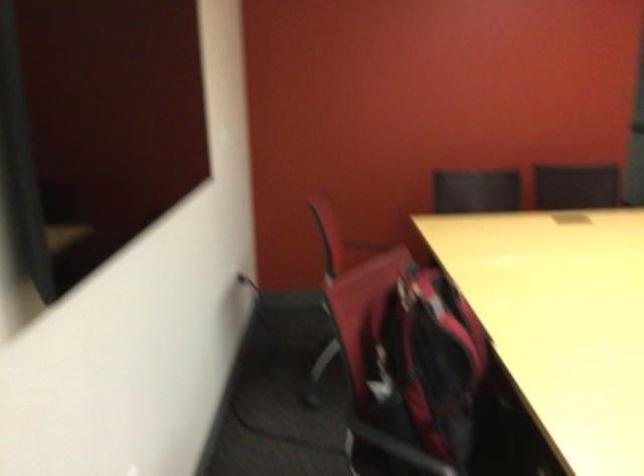
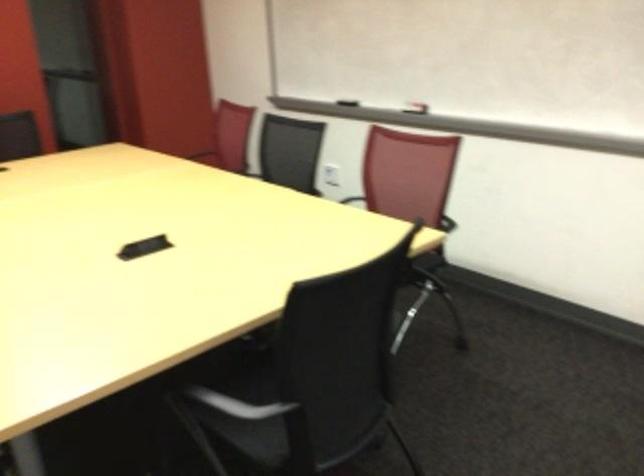
Question: How did the camera likely rotate?

Choices:
 (A) Left
 (B) Right
 (C) Up
 (D) Down

Answer: (B)